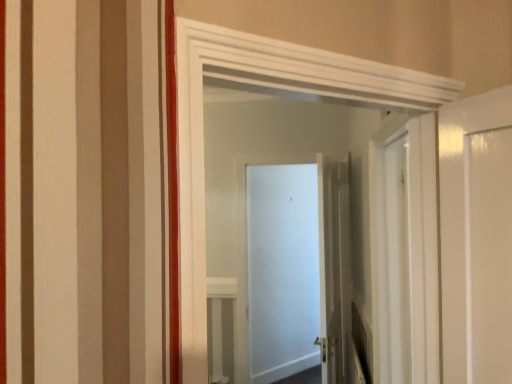
Question: Does white glossy door at center, the 2th door from the back, appear on the right side of white glossy door at center, the first door positioned from the front?

Choices:
 (A) yes
 (B) no

Answer: (A)

Question: Can you confirm if white glossy door at center, the 2th door from the back, is wider than white glossy door at center, which appears as the 3th door when viewed from the back?

Choices:
 (A) yes
 (B) no

Answer: (A)

Question: Could you tell me if white glossy door at center, the 2th door from the back, is turned towards white glossy door at center, which appears as the 3th door when viewed from the back?

Choices:
 (A) yes
 (B) no

Answer: (B)

Question: Is the surface of white glossy door at center, the 2th door from the back, in direct contact with white glossy door at center, which appears as the 3th door when viewed from the back?

Choices:
 (A) no
 (B) yes

Answer: (A)

Question: Considering the relative sizes of white glossy door at center, the 2th door from the back, and white glossy door at center, which appears as the 3th door when viewed from the back, in the image provided, is white glossy door at center, the 2th door from the back, thinner than white glossy door at center, which appears as the 3th door when viewed from the back,?

Choices:
 (A) yes
 (B) no

Answer: (B)

Question: Considering the positions of white glossy door at center, the first door positioned from the front, and white matte door at center, arranged as the third door when viewed from the front, in the image, is white glossy door at center, the first door positioned from the front, taller or shorter than white matte door at center, arranged as the third door when viewed from the front,?

Choices:
 (A) short
 (B) tall

Answer: (A)

Question: Considering the positions of white glossy door at center, which appears as the 3th door when viewed from the back, and white matte door at center, arranged as the third door when viewed from the front, in the image, is white glossy door at center, which appears as the 3th door when viewed from the back, wider or thinner than white matte door at center, arranged as the third door when viewed from the front,?

Choices:
 (A) wide
 (B) thin

Answer: (A)

Question: From the image's perspective, is white glossy door at center, which appears as the 3th door when viewed from the back, positioned above or below white matte door at center, arranged as the third door when viewed from the front?

Choices:
 (A) below
 (B) above

Answer: (B)

Question: From a real-world perspective, relative to white matte door at center, arranged as the third door when viewed from the front, is white glossy door at center, which appears as the 3th door when viewed from the back, vertically above or below?

Choices:
 (A) below
 (B) above

Answer: (B)

Question: In terms of height, does white glossy door at center, which ranks as the second door in front-to-back order, look taller or shorter compared to white glossy door at center, which appears as the 3th door when viewed from the back?

Choices:
 (A) tall
 (B) short

Answer: (A)

Question: Considering the relative positions of white glossy door at center, the 2th door from the back, and white glossy door at center, which appears as the 3th door when viewed from the back, in the image provided, is white glossy door at center, the 2th door from the back, to the left or to the right of white glossy door at center, which appears as the 3th door when viewed from the back,?

Choices:
 (A) left
 (B) right

Answer: (B)

Question: Looking at their shapes, would you say white glossy door at center, which ranks as the second door in front-to-back order, is wider or thinner than white glossy door at center, the first door positioned from the front?

Choices:
 (A) thin
 (B) wide

Answer: (B)

Question: Is white glossy door at center, the 2th door from the back, inside the boundaries of white glossy door at center, which appears as the 3th door when viewed from the back, or outside?

Choices:
 (A) inside
 (B) outside

Answer: (B)

Question: Is white glossy door at center, the 2th door from the back, bigger or smaller than white matte door at center, arranged as the third door when viewed from the front?

Choices:
 (A) big
 (B) small

Answer: (A)

Question: From a real-world perspective, relative to white matte door at center, arranged as the third door when viewed from the front, is white glossy door at center, the 2th door from the back, vertically above or below?

Choices:
 (A) above
 (B) below

Answer: (A)